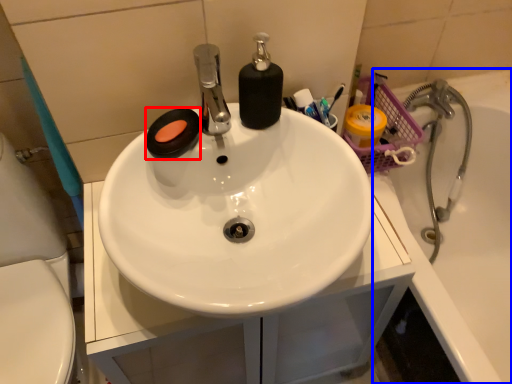
Question: Among these objects, which one is farthest to the camera, soap (highlighted by a red box) or bath (highlighted by a blue box)?

Choices:
 (A) soap
 (B) bath

Answer: (B)